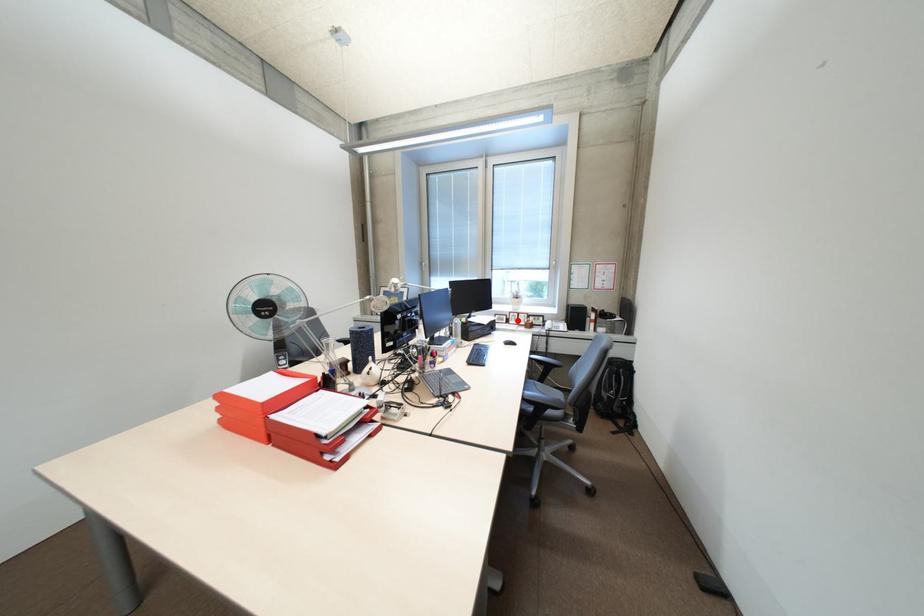
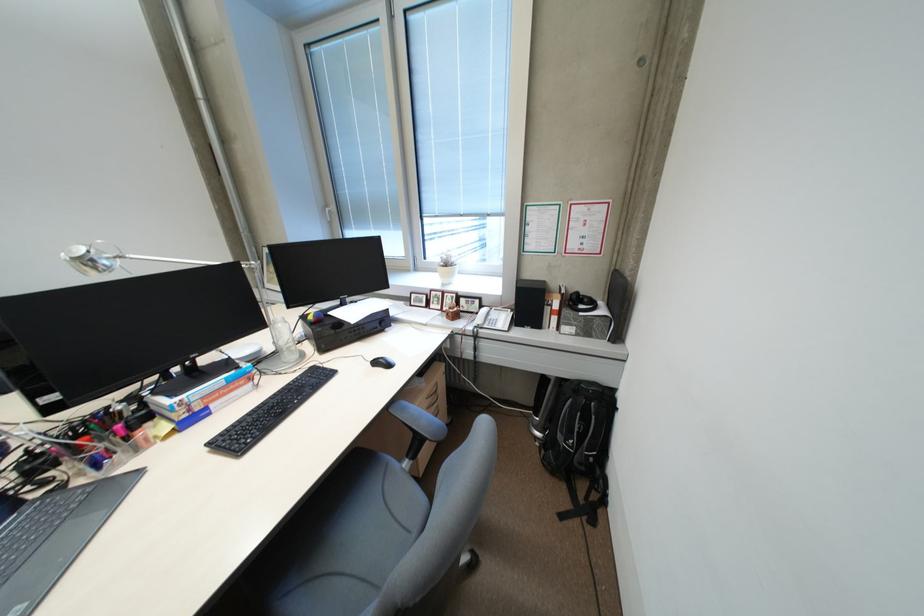
Locate, in the second image, the point that corresponds to the highlighted location in the first image.

(438, 304)